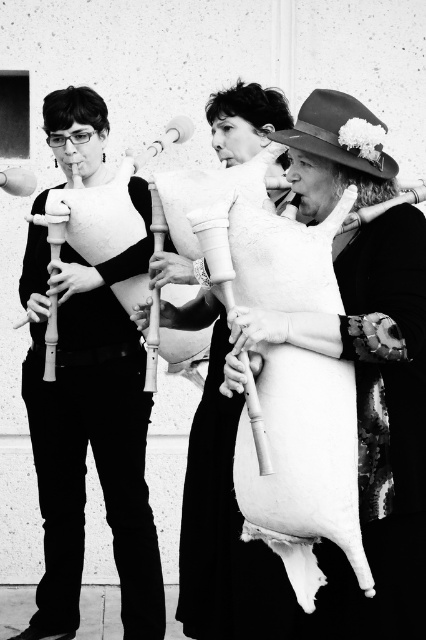
Between matte white flute at left and white matte bagpipe at center, which one has less height?

Standing shorter between the two is white matte bagpipe at center.

Can you confirm if matte white flute at left is thinner than white matte bagpipe at center?

No, matte white flute at left is not thinner than white matte bagpipe at center.

Is point (109, 392) positioned in front of point (281, 196)?

No, it is not.

Find the location of `matte white flute at left`. matte white flute at left is located at coordinates (89, 435).